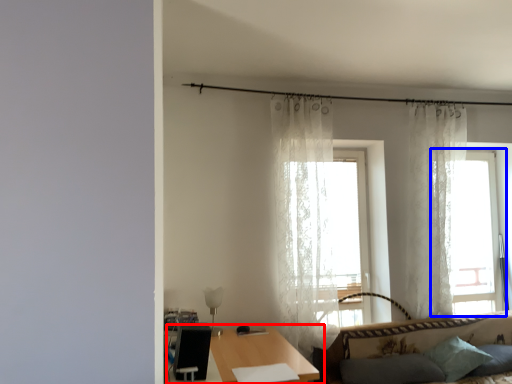
Question: Which object appears farthest to the camera in this image, table (highlighted by a red box) or window (highlighted by a blue box)?

Choices:
 (A) table
 (B) window

Answer: (B)